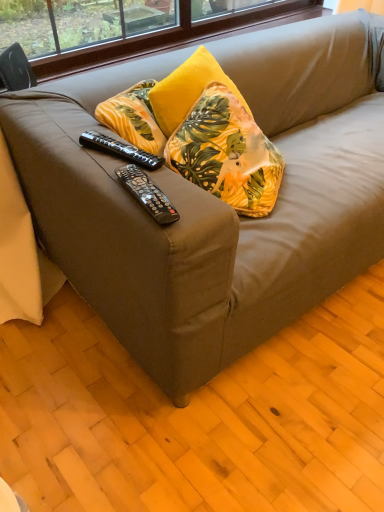
Question: Considering their positions, is black plastic remote control at center, placed as the first remote control when sorted from top to bottom, located in front of or behind black plastic remote control at center, positioned as the second remote control in back-to-front order?

Choices:
 (A) front
 (B) behind

Answer: (B)

Question: Is black plastic remote control at center, which appears as the second remote control when viewed from the front, inside the boundaries of black plastic remote control at center, marked as the first remote control in a bottom-to-top arrangement, or outside?

Choices:
 (A) inside
 (B) outside

Answer: (B)

Question: Estimate the real-world distances between objects in this image. Which object is closer to the yellow fabric pillow at center?

Choices:
 (A) black plastic remote control at center, positioned as the 2th remote control in bottom-to-top order
 (B) black plastic remote control at center, positioned as the second remote control in back-to-front order

Answer: (A)

Question: Which of these objects is positioned farthest from the black plastic remote control at center, the 1th remote control positioned from the back?

Choices:
 (A) yellow fabric pillow at center
 (B) black plastic remote control at center, marked as the first remote control in a bottom-to-top arrangement

Answer: (A)